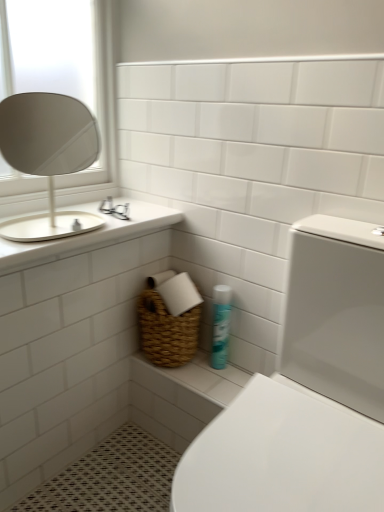
This screenshot has width=384, height=512. In order to click on free spot to the left of blue glossy spray can at lower center in this screenshot , I will do `click(192, 366)`.